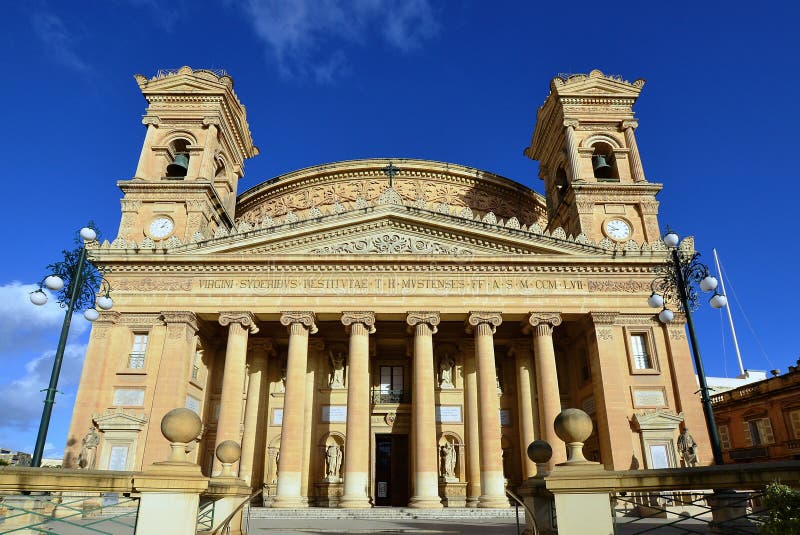
The height and width of the screenshot is (535, 800). In order to click on round decor in this screenshot , I will do `click(572, 425)`, `click(538, 450)`, `click(185, 432)`, `click(232, 453)`.